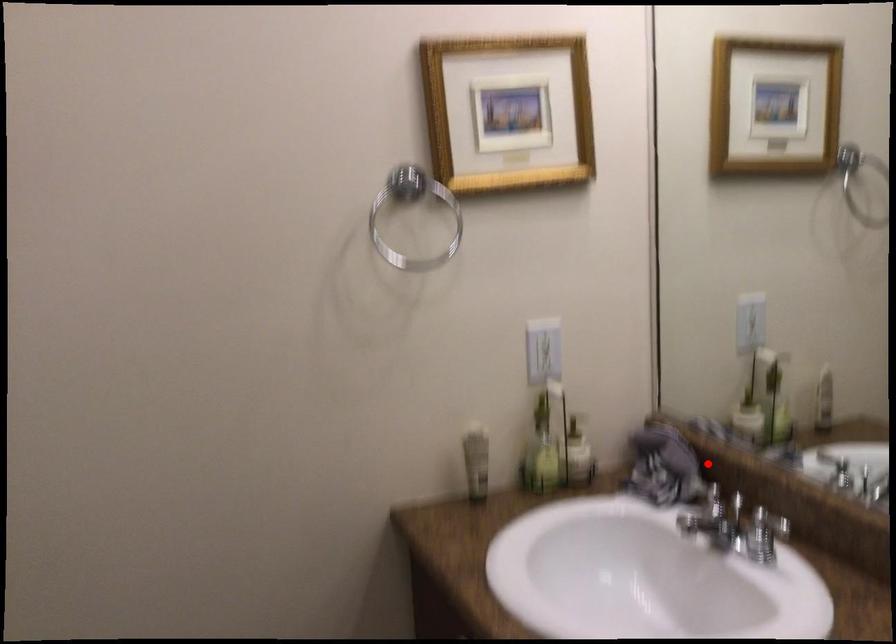
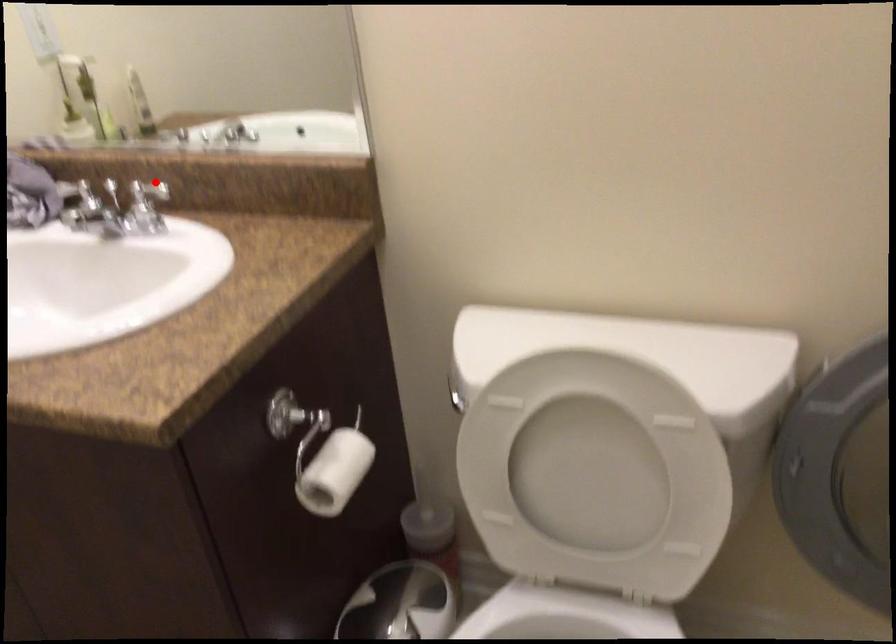
I am providing you with two images of the same scene from different viewpoints. A red point is marked on the first image and another point is marked on the second image. Is the marked point in image1 the same physical position as the marked point in image2?

No